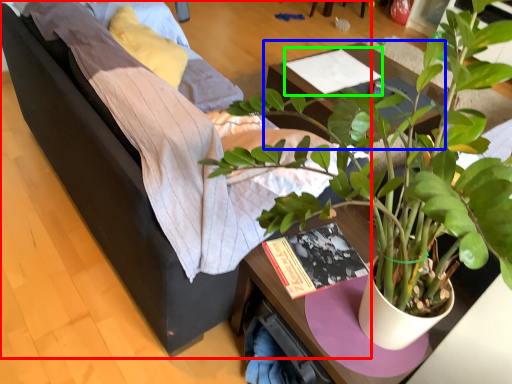
Question: Which object is positioned closest to studio couch (highlighted by a red box)? Select from table (highlighted by a blue box) and magazine (highlighted by a green box).

Choices:
 (A) table
 (B) magazine

Answer: (A)